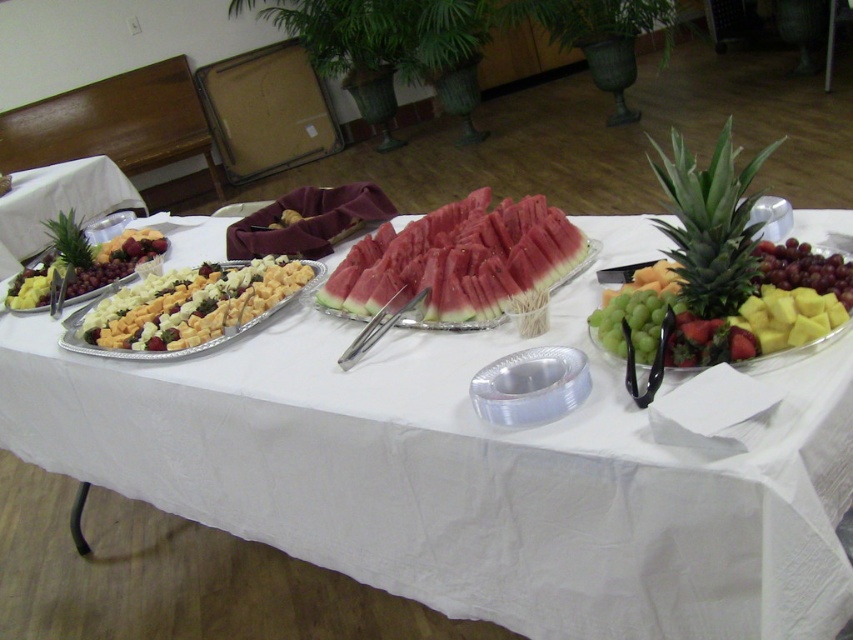
Between point (223, 280) and point (67, 189), which one is positioned behind?

Positioned behind is point (67, 189).

Locate an element on the screen. The height and width of the screenshot is (640, 853). white cheese at center is located at coordinates (187, 308).

Where is `white cheese at center`? The image size is (853, 640). white cheese at center is located at coordinates (187, 308).

Is pink flesh watermelon at center below yellow matte pineapple at right?

No, pink flesh watermelon at center is not below yellow matte pineapple at right.

Who is more forward, [525,227] or [656,273]?

Point [656,273] is in front.

The width and height of the screenshot is (853, 640). Find the location of `pink flesh watermelon at center`. pink flesh watermelon at center is located at coordinates (457, 259).

Does point (190, 321) come in front of point (648, 275)?

No, (190, 321) is further to viewer.

Between white cheese at center and yellow matte pineapple at right, which one has more height?

white cheese at center is taller.

Identify the location of white cheese at center. This screenshot has width=853, height=640. (187, 308).